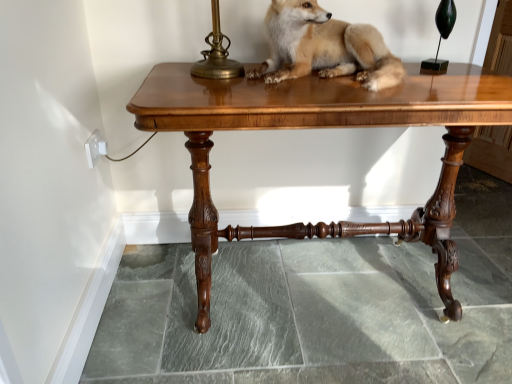
Question: Relative to shiny brass table lamp at upper right, is glossy wood table at center in front or behind?

Choices:
 (A) behind
 (B) front

Answer: (B)

Question: In terms of size, does glossy wood table at center appear bigger or smaller than shiny brass table lamp at upper right?

Choices:
 (A) small
 (B) big

Answer: (B)

Question: Estimate the real-world distances between objects in this image. Which object is farther from the glossy wood table at center?

Choices:
 (A) shiny brass table lamp at upper right
 (B) light brown fur at center

Answer: (A)

Question: Which object is positioned farthest from the glossy wood table at center?

Choices:
 (A) shiny brass table lamp at upper right
 (B) light brown fur at center

Answer: (A)